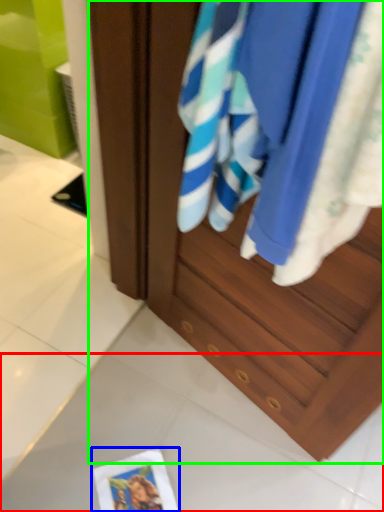
Question: Considering the real-world distances, which object is closest to tile (highlighted by a red box)? postcard (highlighted by a blue box) or cabinetry (highlighted by a green box).

Choices:
 (A) postcard
 (B) cabinetry

Answer: (A)